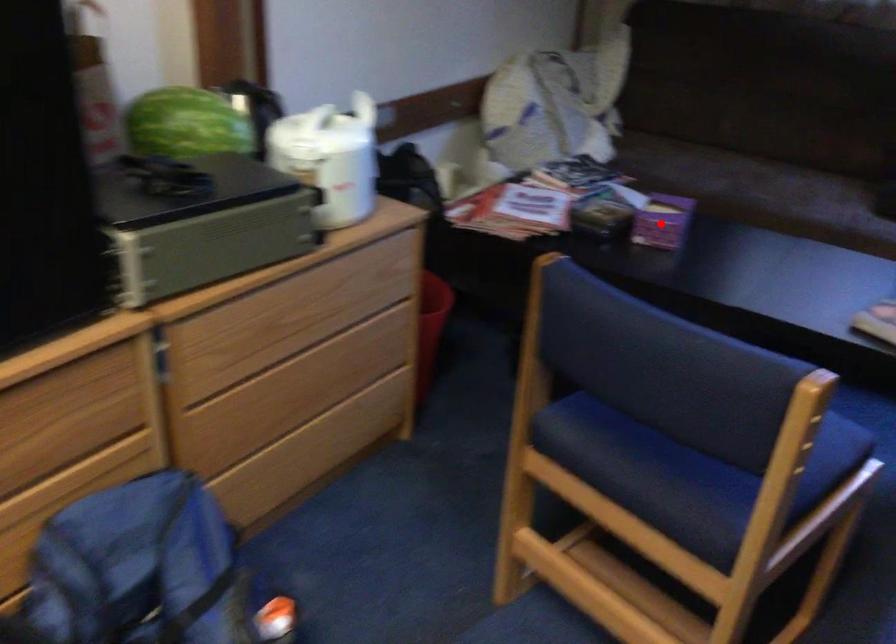
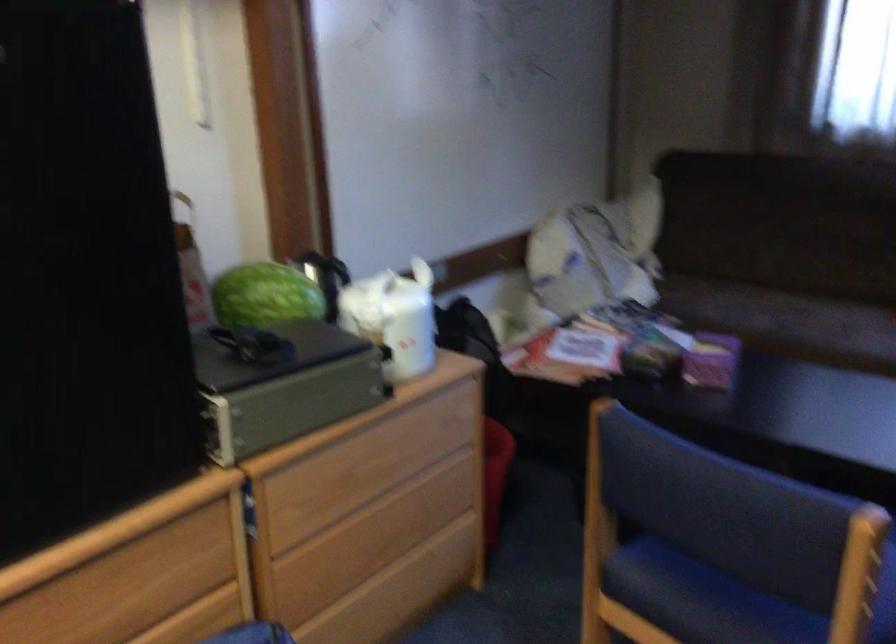
Find the pixel in the second image that matches the highlighted location in the first image.

(711, 361)